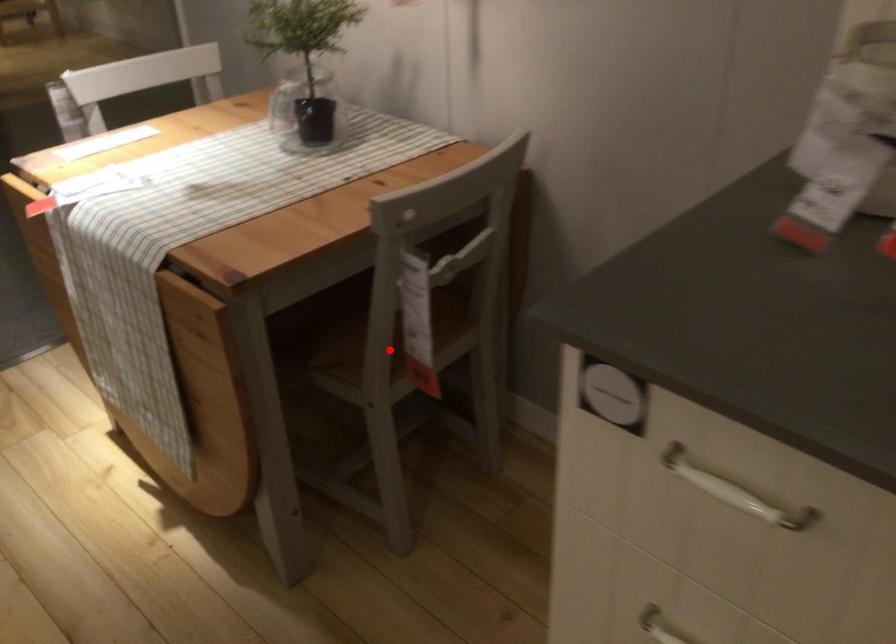
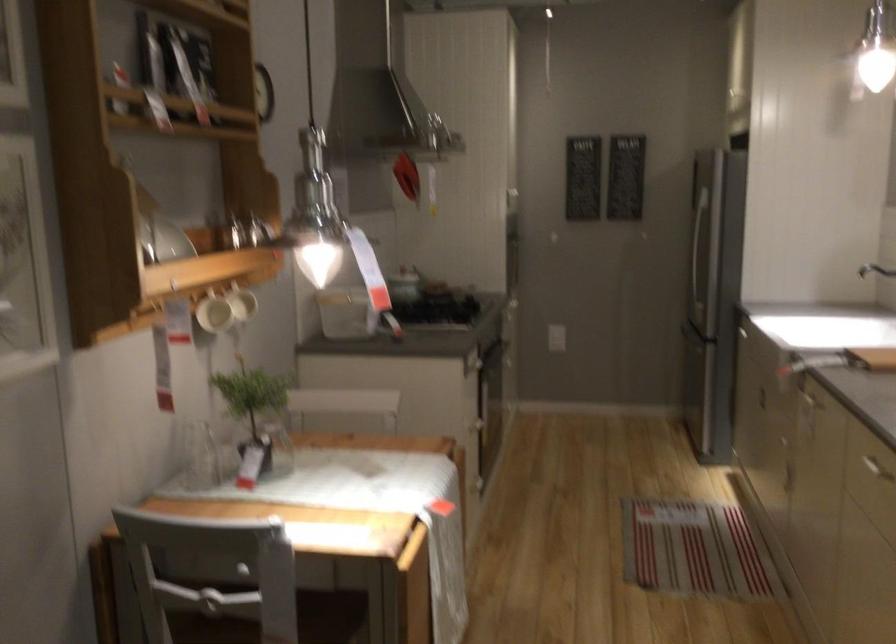
Question: I am providing you with two images of the same scene from different viewpoints. A red point is marked on the first image. Is the red point's position out of view in image 2?

Choices:
 (A) Yes
 (B) No

Answer: (A)